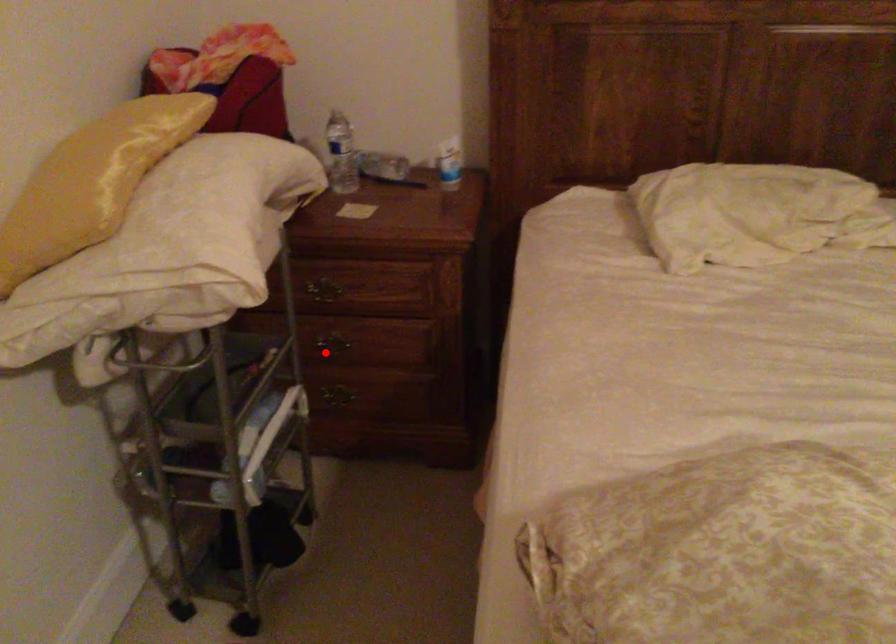
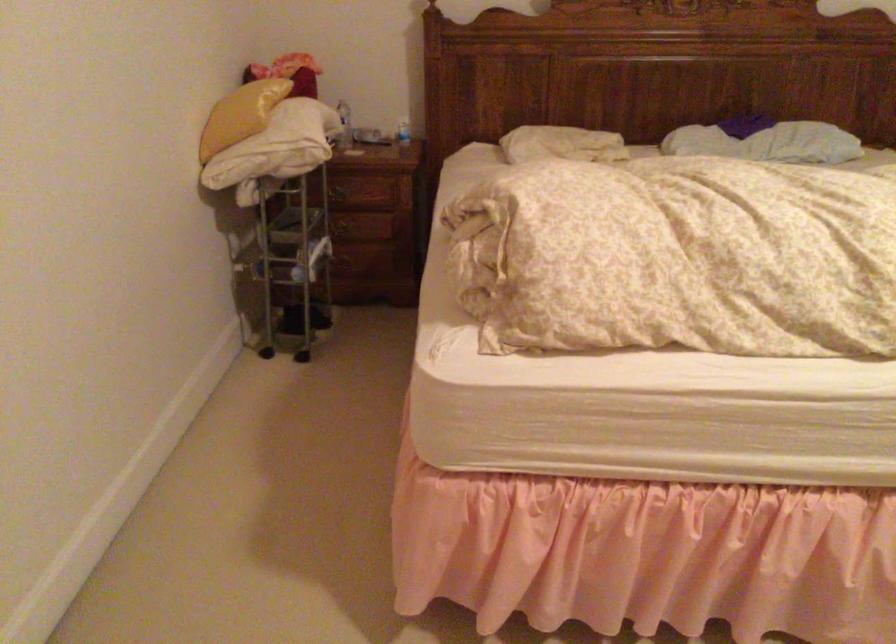
Question: I am providing you with two images of the same scene from different viewpoints. In image1, a red point is highlighted. Considering the same 3D point in image2, which of the following is correct?

Choices:
 (A) It is closer
 (B) It is farther

Answer: (B)